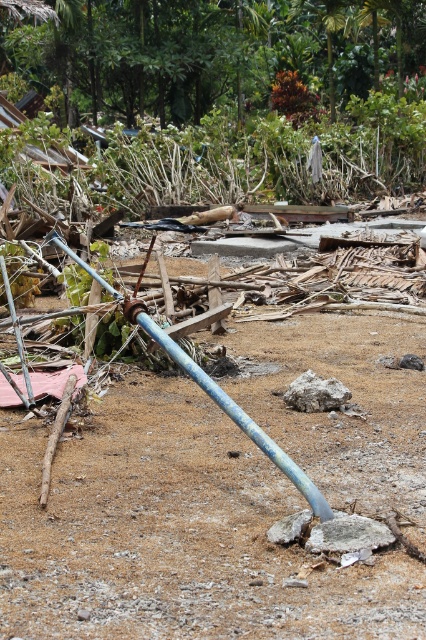
Question: Can you confirm if brown sandy dirt at center is smaller than blue painted metal water pipe at center?

Choices:
 (A) no
 (B) yes

Answer: (A)

Question: Is brown sandy dirt at center thinner than blue painted metal water pipe at center?

Choices:
 (A) no
 (B) yes

Answer: (A)

Question: Which object is farther from the camera taking this photo?

Choices:
 (A) blue painted metal water pipe at center
 (B) brown sandy dirt at center

Answer: (A)

Question: Which object is farther from the camera taking this photo?

Choices:
 (A) brown sandy dirt at center
 (B) blue painted metal water pipe at center

Answer: (B)

Question: Does brown sandy dirt at center have a smaller size compared to blue painted metal water pipe at center?

Choices:
 (A) yes
 (B) no

Answer: (B)